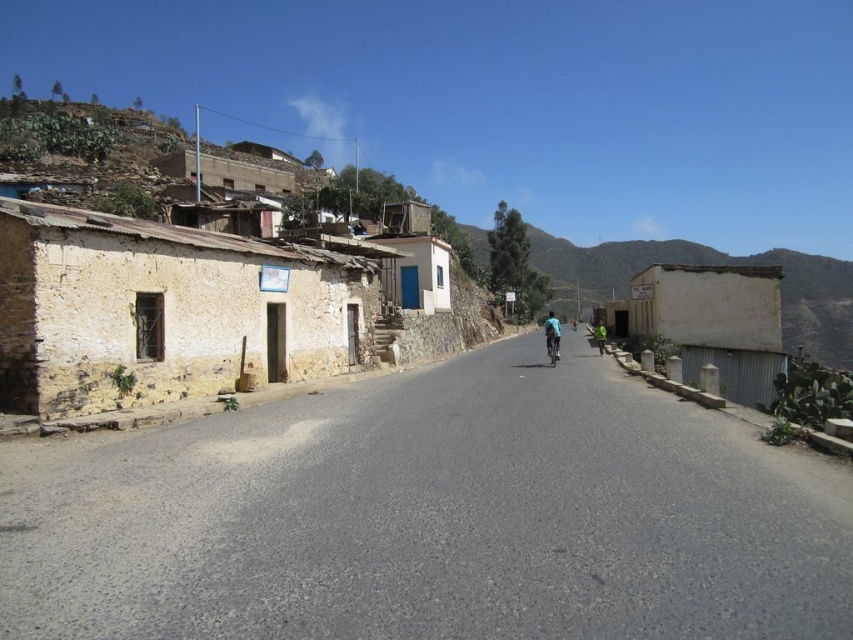
You are standing at the starting point of the road and want to locate the blue fabric cyclist at center. According to the coordinates provided, in which direction should you look to find it?

The blue fabric cyclist at center is located at coordinates point (552, 333), so you should look towards the center of the image to find it.

You are standing at the center of the rural road and see the yellow stucco wall at left and the blue fabric cyclist at center. Which object is larger in size?

The yellow stucco wall at left is bigger than the blue fabric cyclist at center.